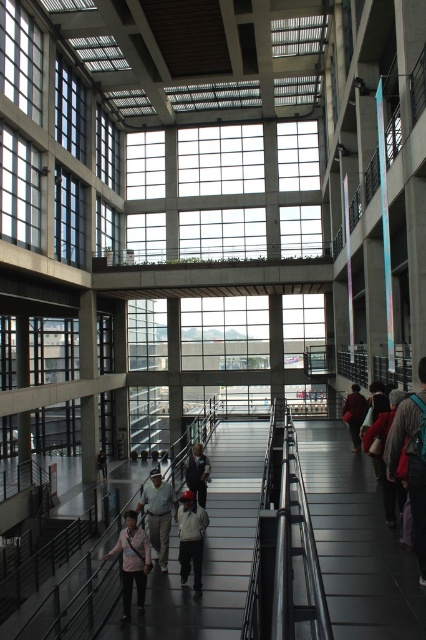
Question: Is metallic gray escalator at center thinner than white cotton shirt at center?

Choices:
 (A) yes
 (B) no

Answer: (B)

Question: Which point is farther to the camera?

Choices:
 (A) dark gray sweater at right
 (B) dark gray sweater at center

Answer: (B)

Question: Which object is the closest to the white cotton shirt at center?

Choices:
 (A) light pink fabric at center
 (B) dark gray backpack at right

Answer: (A)

Question: Which is nearer to the dark gray sweater at center?

Choices:
 (A) metallic gray escalator at center
 (B) dark gray backpack at right
 (C) red fabric pants at center

Answer: (A)

Question: Does metallic gray escalator at center appear under light brown leather jacket at center?

Choices:
 (A) yes
 (B) no

Answer: (A)

Question: Is metallic gray escalator at center in front of light pink fabric at center?

Choices:
 (A) yes
 (B) no

Answer: (A)